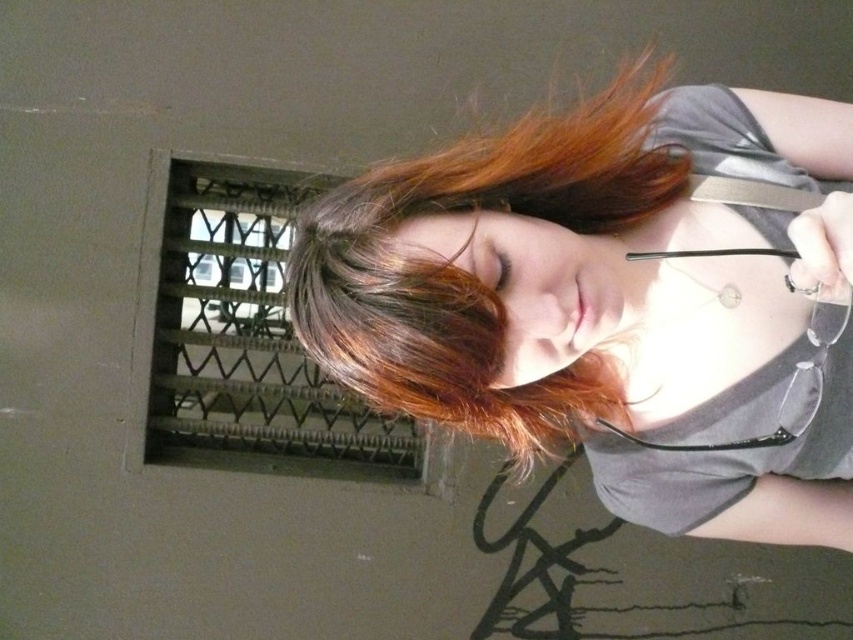
You are an architect designing a new building and need to place two points on a wall. The first point is at coordinates point (798, 195) and the second point is at point (363, 184). According to the scene, which point is closer to the viewer?

Point (363, 184) is closer to the viewer because it is in front of point (798, 195) as stated in the description.

You are a fashion designer observing the image. You need to determine the placement of the matte gray shirt at center relative to the shiny brown hair at center. Is the shirt above or below the hair?

The matte gray shirt at center is positioned under shiny brown hair at center, meaning the shirt is below the hair.